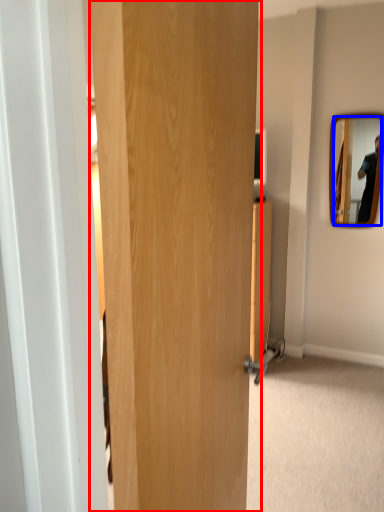
Question: Which object is further to the camera taking this photo, door (highlighted by a red box) or mirror (highlighted by a blue box)?

Choices:
 (A) door
 (B) mirror

Answer: (B)